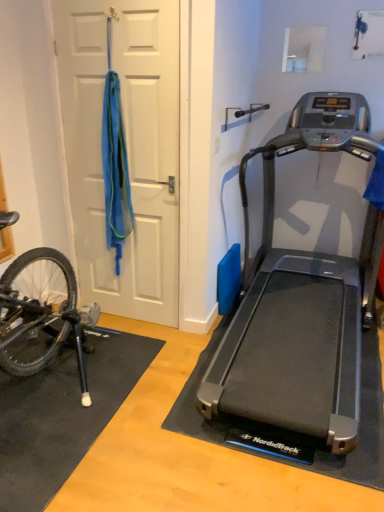
Question: Is black rubber doormat at lower left not close to silver metallic treadmill at right?

Choices:
 (A) no
 (B) yes

Answer: (A)

Question: From a real-world perspective, is black rubber doormat at lower left on top of silver metallic treadmill at right?

Choices:
 (A) yes
 (B) no

Answer: (B)

Question: Is black rubber doormat at lower left oriented away from silver metallic treadmill at right?

Choices:
 (A) yes
 (B) no

Answer: (B)

Question: Is black rubber doormat at lower left positioned before silver metallic treadmill at right?

Choices:
 (A) yes
 (B) no

Answer: (B)

Question: From a real-world perspective, does black rubber doormat at lower left sit lower than silver metallic treadmill at right?

Choices:
 (A) yes
 (B) no

Answer: (A)

Question: Does black rubber doormat at lower left appear on the right side of silver metallic treadmill at right?

Choices:
 (A) yes
 (B) no

Answer: (B)

Question: Is the depth of black rubber doormat at lower left less than that of white matte door at left?

Choices:
 (A) yes
 (B) no

Answer: (A)

Question: Can you confirm if black rubber doormat at lower left is thinner than white matte door at left?

Choices:
 (A) yes
 (B) no

Answer: (B)

Question: From a real-world perspective, is black rubber doormat at lower left below white matte door at left?

Choices:
 (A) yes
 (B) no

Answer: (A)

Question: From the image's perspective, is black rubber doormat at lower left below white matte door at left?

Choices:
 (A) no
 (B) yes

Answer: (B)

Question: Can you confirm if black rubber doormat at lower left is taller than white matte door at left?

Choices:
 (A) no
 (B) yes

Answer: (A)

Question: Are black rubber doormat at lower left and white matte door at left beside each other?

Choices:
 (A) no
 (B) yes

Answer: (A)

Question: Can we say white matte door at left lies outside black rubber doormat at lower left?

Choices:
 (A) no
 (B) yes

Answer: (B)